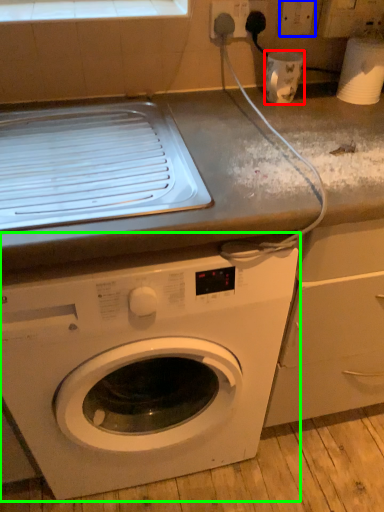
Question: Which object is positioned closest to appliance (highlighted by a red box)? Select from electric outlet (highlighted by a blue box) and washing machine (highlighted by a green box).

Choices:
 (A) electric outlet
 (B) washing machine

Answer: (A)